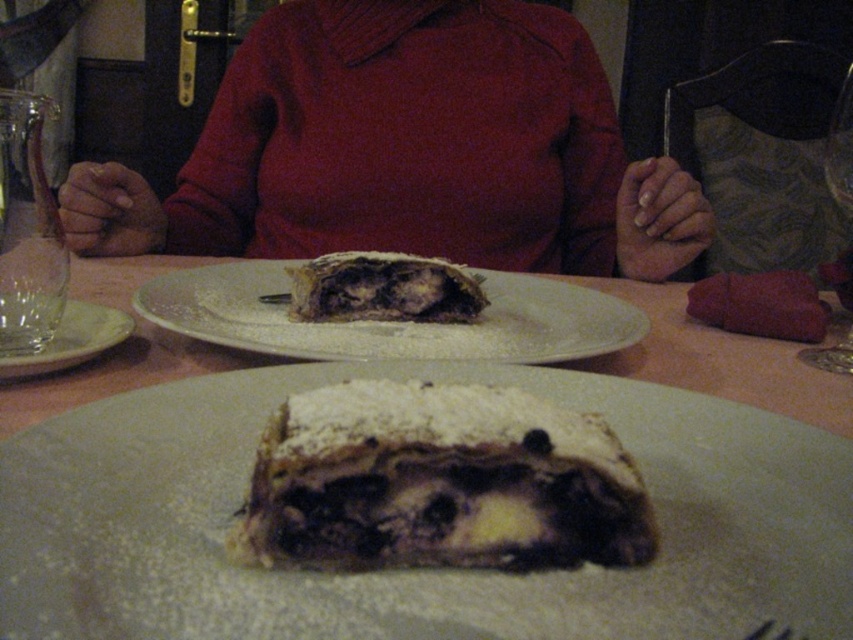
Question: Is white ceramic plate at center in front of dusty brown pastry at center?

Choices:
 (A) no
 (B) yes

Answer: (B)

Question: Which of the following is the closest to the observer?

Choices:
 (A) powdered white cake at center
 (B) powdery white pastry at center
 (C) dusty brown pastry at center
 (D) white ceramic plate at center

Answer: (A)

Question: Based on their relative distances, which object is farther from the transparent glass wine glass at lower right?

Choices:
 (A) powdery white pastry at center
 (B) white ceramic plate at center

Answer: (A)

Question: Which point is closer to the camera?

Choices:
 (A) powdered white cake at center
 (B) white matte plate at lower center
 (C) powdery white pastry at center

Answer: (A)

Question: Does dusty brown pastry at center have a greater width compared to transparent glass wine glass at lower right?

Choices:
 (A) no
 (B) yes

Answer: (A)

Question: In this image, where is powdered white cake at center located relative to dusty brown pastry at center?

Choices:
 (A) right
 (B) left

Answer: (A)